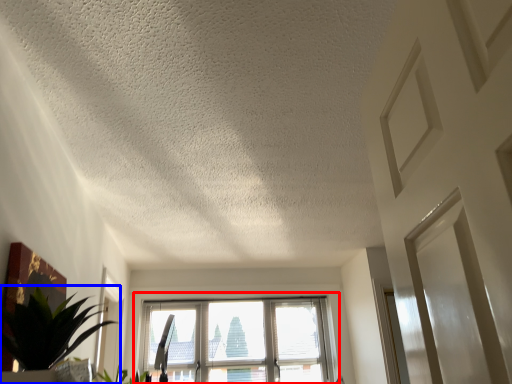
Question: Which of the following is the closest to the observer, window (highlighted by a red box) or houseplant (highlighted by a blue box)?

Choices:
 (A) window
 (B) houseplant

Answer: (B)